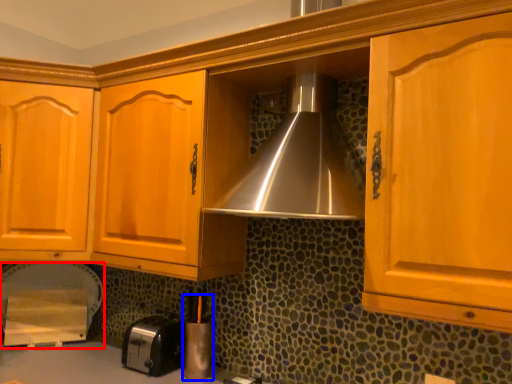
Question: Which object appears farthest to the camera in this image, appliance (highlighted by a red box) or appliance (highlighted by a blue box)?

Choices:
 (A) appliance
 (B) appliance

Answer: (A)